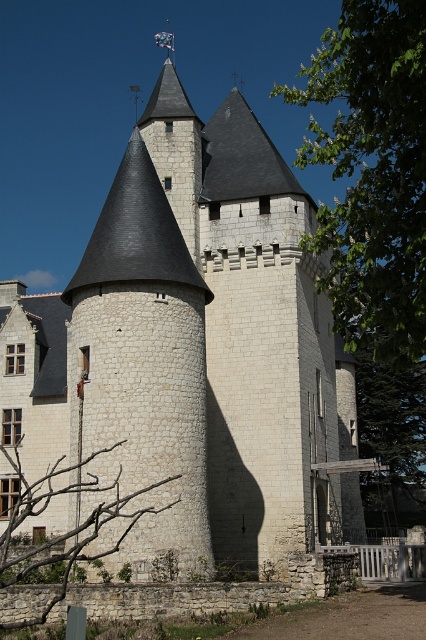
Question: Does green leafy tree at upper right have a greater width compared to bare branches at lower left?

Choices:
 (A) yes
 (B) no

Answer: (A)

Question: Observing the image, what is the correct spatial positioning of green leafy tree at upper right in reference to bare branches at lower left?

Choices:
 (A) below
 (B) above

Answer: (B)

Question: Which object is farther from the camera taking this photo?

Choices:
 (A) bare branches at lower left
 (B) green leafy tree at upper right

Answer: (B)

Question: Which point is farther to the camera?

Choices:
 (A) green leafy tree at upper right
 (B) bare branches at lower left

Answer: (A)

Question: Can you confirm if green leafy tree at upper right is wider than bare branches at lower left?

Choices:
 (A) no
 (B) yes

Answer: (B)

Question: Which object appears closest to the camera in this image?

Choices:
 (A) bare branches at lower left
 (B) green leafy tree at upper right

Answer: (A)